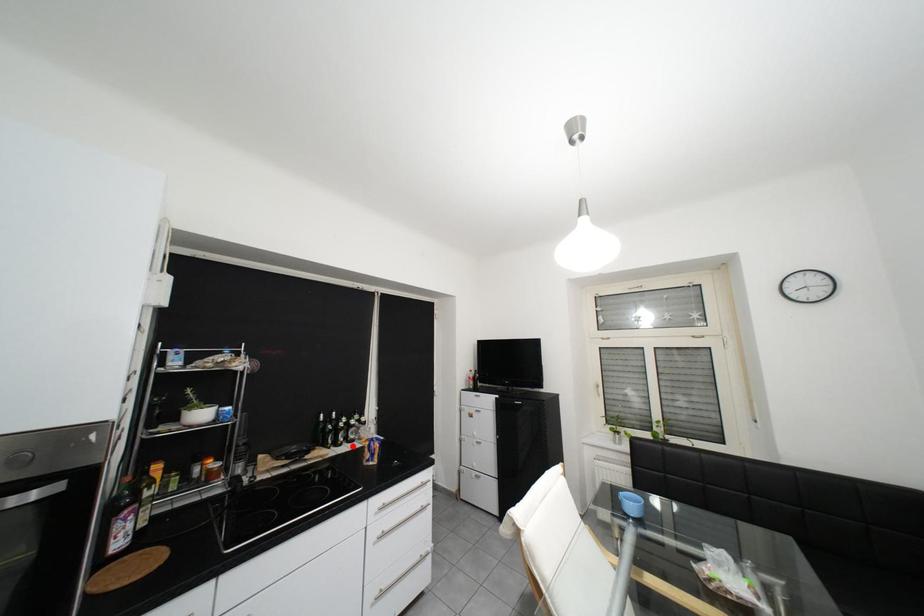
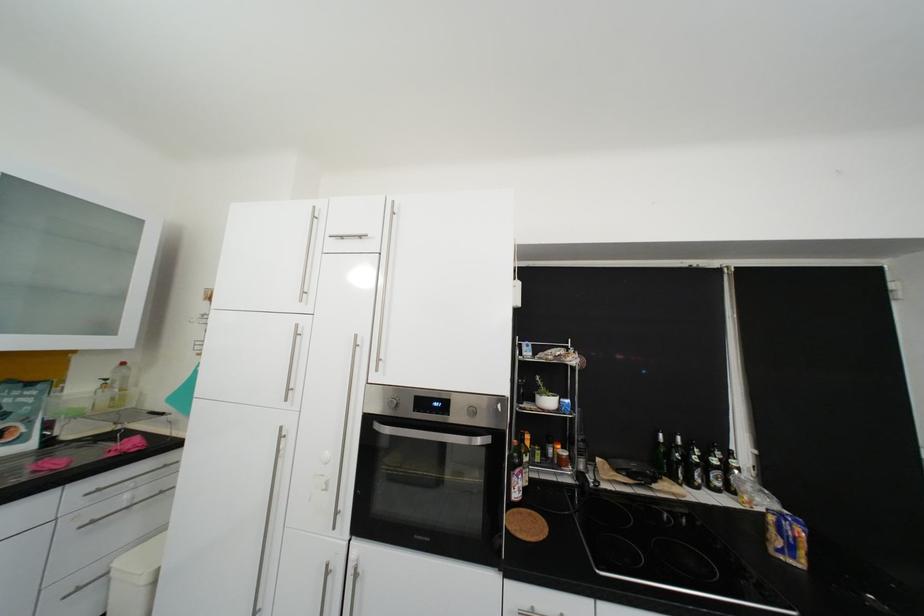
Where in the second image is the point corresponding to the highlighted location from the first image?

(710, 488)